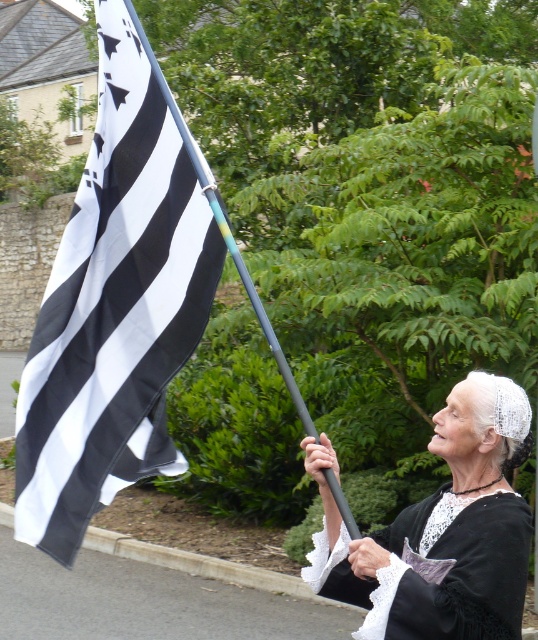
The image size is (538, 640). Describe the element at coordinates (440, 531) in the screenshot. I see `white lace dress at center` at that location.

Is white lace dress at center smaller than black plastic pole at upper left?

Yes.

At what (x,y) coordinates should I click in order to perform the action: click on white lace dress at center. Please return your answer as a coordinate pair (x, y). Image resolution: width=538 pixels, height=640 pixels. Looking at the image, I should click on point(440,531).

This screenshot has width=538, height=640. In order to click on black and white striped flag at upper left in this screenshot , I will do `click(114, 307)`.

Is black and white striped flag at upper left to the left of white lace dress at center from the viewer's perspective?

Correct, you'll find black and white striped flag at upper left to the left of white lace dress at center.

Which is behind, point (88, 346) or point (519, 540)?

The point (88, 346) is more distant.

Locate an element on the screen. The height and width of the screenshot is (640, 538). black and white striped flag at upper left is located at coordinates (114, 307).

Which is in front, point (89, 374) or point (240, 276)?

Point (240, 276)

Who is more distant from viewer, (178, 198) or (303, 426)?

Point (303, 426)

The width and height of the screenshot is (538, 640). Identify the location of black and white striped flag at upper left. (114, 307).